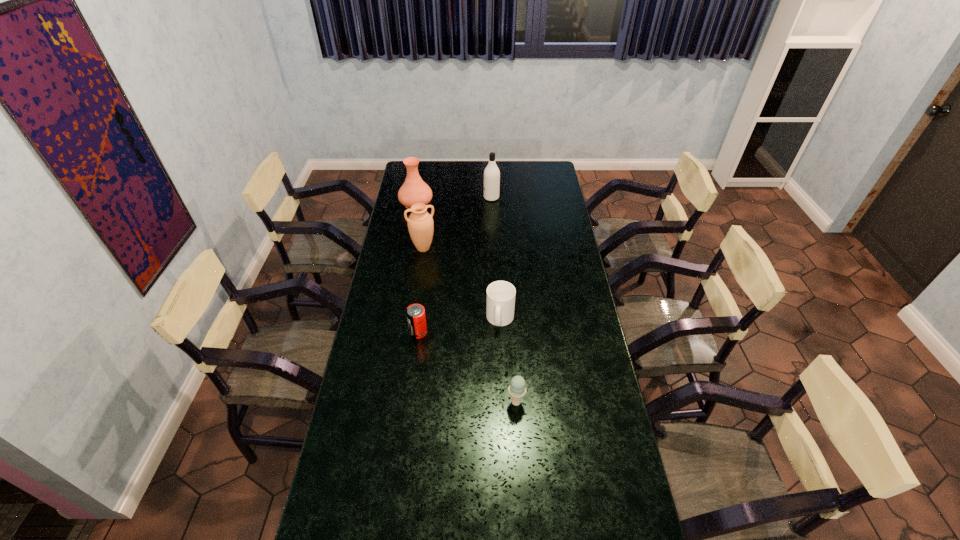
The width and height of the screenshot is (960, 540). Identify the location of shampoo. (491, 187).

This screenshot has width=960, height=540. What are the coordinates of `vase` in the screenshot? It's located at (414, 190).

Identify the location of urn. The width and height of the screenshot is (960, 540). (x=420, y=223).

What are the coordinates of `mug` in the screenshot? It's located at (500, 306).

This screenshot has width=960, height=540. I want to click on the nearest object, so click(x=517, y=389).

This screenshot has width=960, height=540. What are the coordinates of `can` in the screenshot? It's located at (415, 313).

Find the location of `vacant space located 0.190m on the front-facing side of the shampoo`. vacant space located 0.190m on the front-facing side of the shampoo is located at coordinates (447, 198).

Find the location of a particular element. The height and width of the screenshot is (540, 960). free space located on the front-facing side of the shampoo is located at coordinates (440, 198).

Where is `vacant space located on the front-facing side of the shampoo`? vacant space located on the front-facing side of the shampoo is located at coordinates (451, 198).

Locate an element on the screen. free space located 0.220m on the back of the vase is located at coordinates (421, 173).